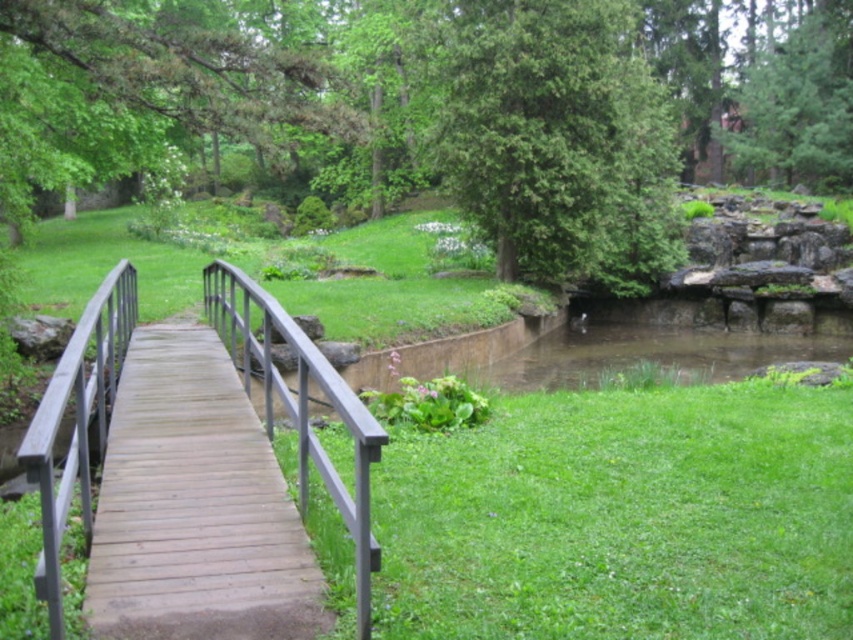
Question: Considering the real-world distances, which object is closest to the green textured tree at upper center?

Choices:
 (A) brown wood rail at left
 (B) green textured tree at upper right
 (C) wooden bridge at center

Answer: (C)

Question: Which of the following is the closest to the observer?

Choices:
 (A) green textured tree at upper center
 (B) brown wood rail at left
 (C) wooden bridge at center

Answer: (C)

Question: Does green textured tree at upper right appear on the right side of brown wood rail at left?

Choices:
 (A) no
 (B) yes

Answer: (B)

Question: Is green textured tree at upper center below brown wood rail at left?

Choices:
 (A) no
 (B) yes

Answer: (A)

Question: Which point is farther from the camera taking this photo?

Choices:
 (A) (350, 397)
 (B) (662, 202)
 (C) (781, 134)
 (D) (61, 577)

Answer: (C)

Question: Does green textured tree at upper center appear on the right side of brown wood rail at left?

Choices:
 (A) yes
 (B) no

Answer: (A)